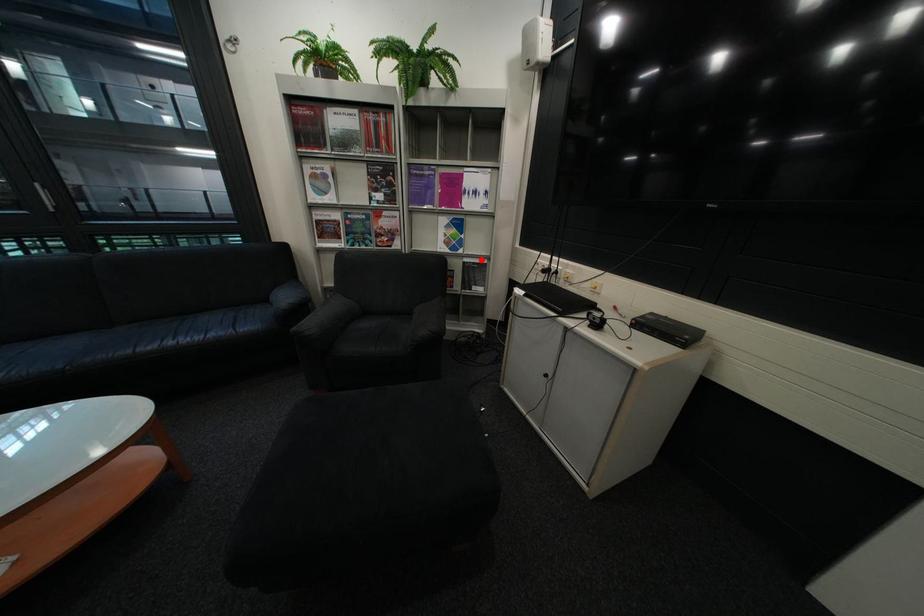
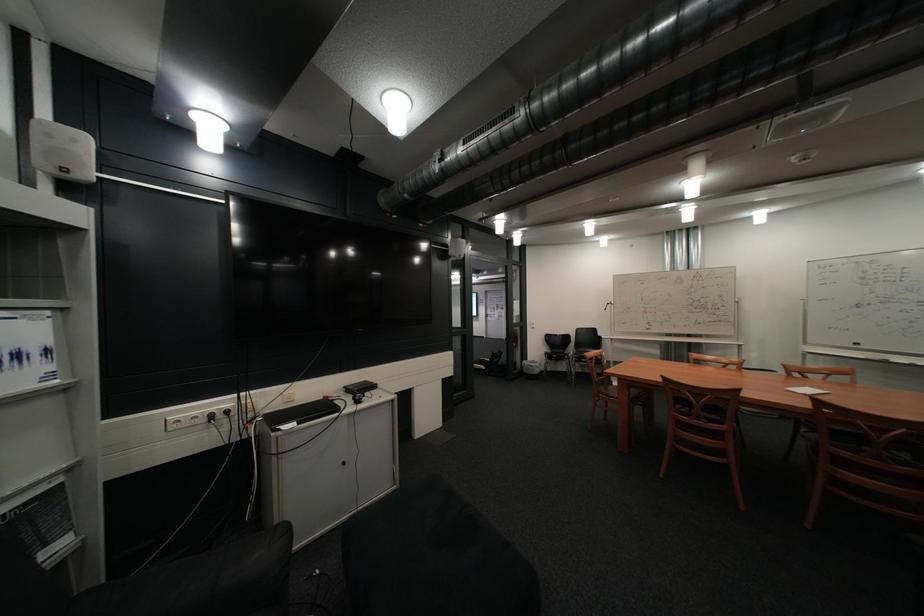
In the second image, find the point that corresponds to the highlighted location in the first image.

(10, 514)